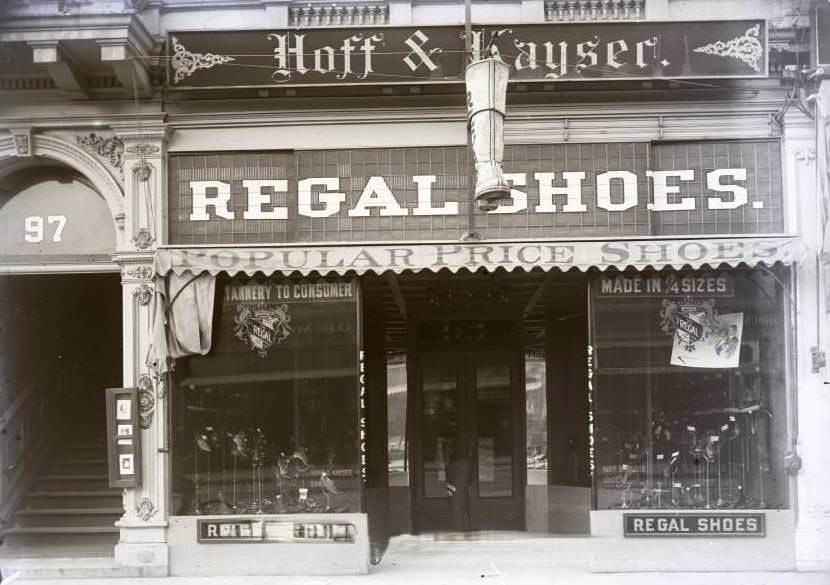
The height and width of the screenshot is (585, 830). I want to click on door, so click(437, 460), click(486, 457).